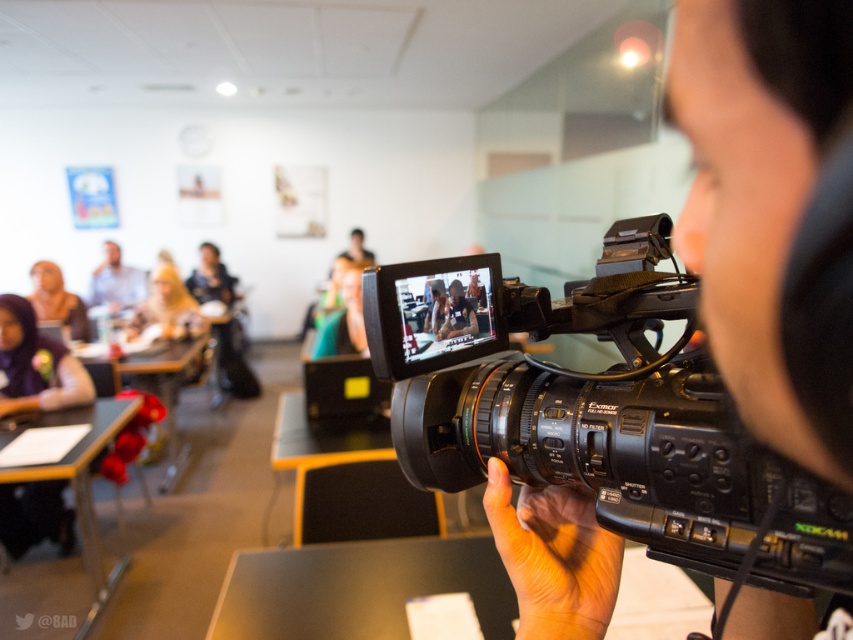
In the scene shown: You are standing in the classroom and want to determine which of the two points, point (x=53, y=320) or point (x=97, y=296), is closer to you. Based on the scene description, which point is nearer?

Point (x=53, y=320) is closer to the viewer than point (x=97, y=296).

You are a photographer trying to capture a group photo of the purple hair at upper left and the wooden table at lower left. Which object is shorter in height?

The purple hair at upper left has a lesser height compared to the wooden table at lower left, so the purple hair at upper left is shorter in height.

You are a photographer standing in the classroom. You need to capture a closeup shot of the black plastic video camera at center. Considering your current position, can you move closer to the camera to get a better closeup without moving the camera itself?

The black plastic video camera at center is 11.05 inches away from viewer. Since this distance is relatively close, you can likely move closer to achieve an even better closeup shot as long as there is enough space between you and the camera.